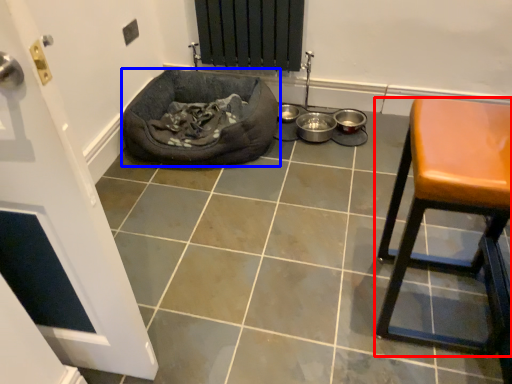
Question: Which object is further to the camera taking this photo, furniture (highlighted by a red box) or dog bed (highlighted by a blue box)?

Choices:
 (A) furniture
 (B) dog bed

Answer: (B)